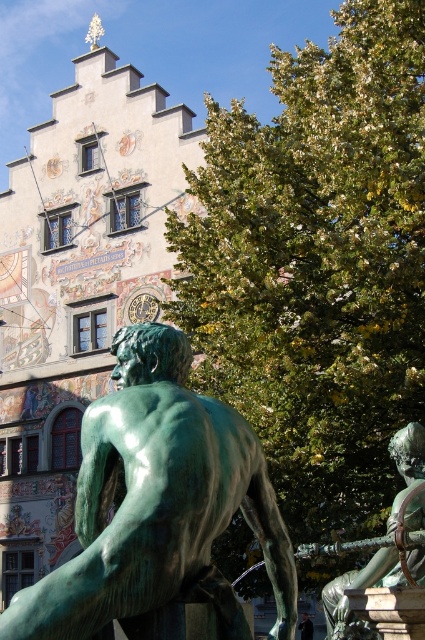
Where is `green patina bronze at center`? green patina bronze at center is located at coordinates (158, 502).

Is green patina bronze at center smaller than green patina sword at right?

No.

Does point (275, 582) lie in front of point (391, 456)?

Yes, it is in front of point (391, 456).

Identify the location of green patina bronze at center. (158, 502).